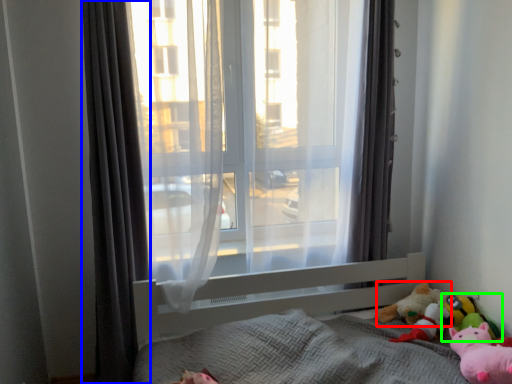
Question: Considering the real-world distances, which object is closest to toy (highlighted by a red box)? curtain (highlighted by a blue box) or toy (highlighted by a green box).

Choices:
 (A) curtain
 (B) toy

Answer: (B)